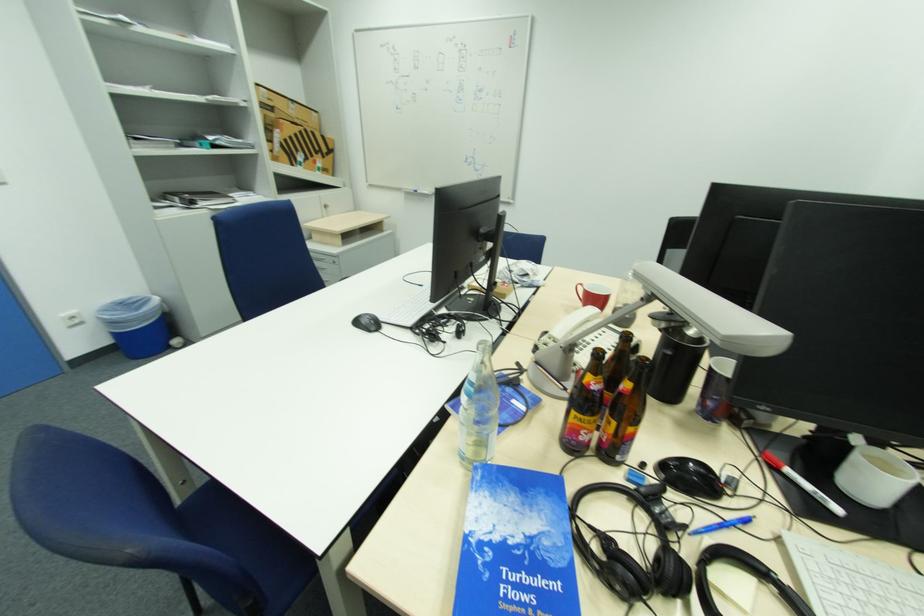
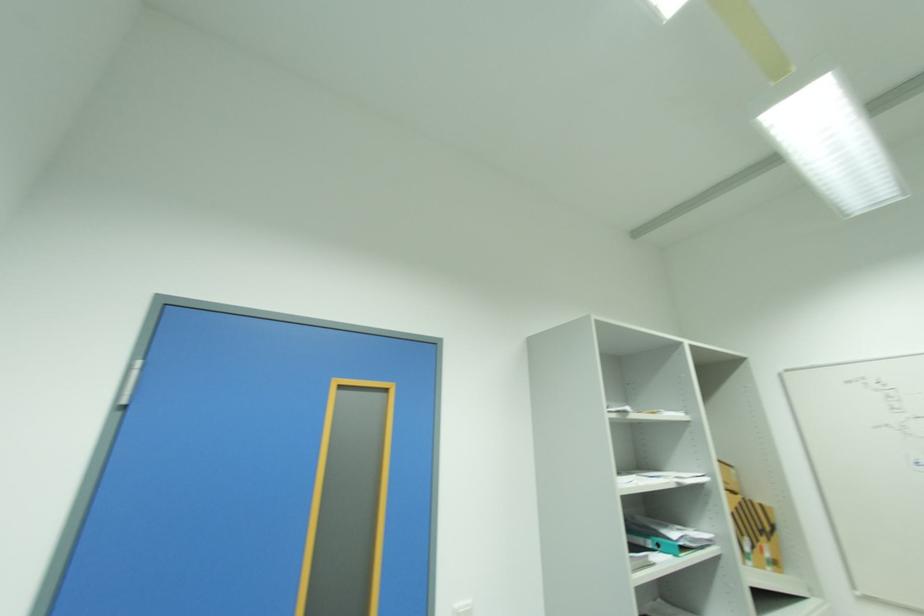
In the second image, find the point that corresponds to (307,134) in the first image.

(746, 506)